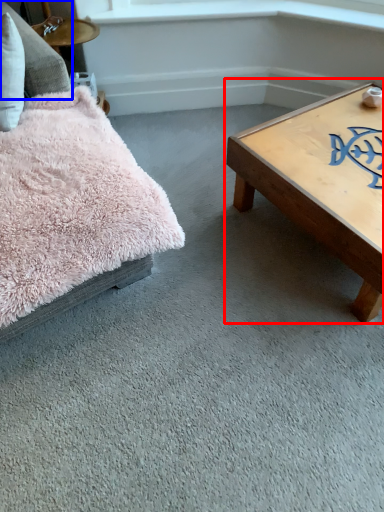
Question: Which point is closer to the camera, coffee table (highlighted by a red box) or pillow (highlighted by a blue box)?

Choices:
 (A) coffee table
 (B) pillow

Answer: (B)